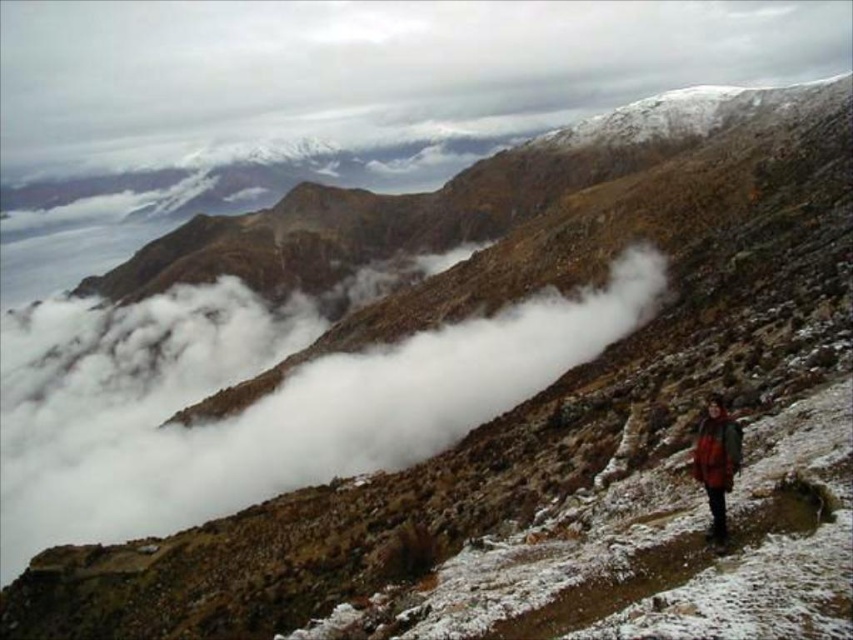
Is white fluffy cloud at upper center above red plaid jacket at lower right?

Yes.

Between white fluffy cloud at upper center and red plaid jacket at lower right, which one has less height?

Standing shorter between the two is red plaid jacket at lower right.

Who is more forward, (x=39, y=76) or (x=724, y=531)?

Point (x=724, y=531)

Image resolution: width=853 pixels, height=640 pixels. Identify the location of white fluffy cloud at upper center. (364, 74).